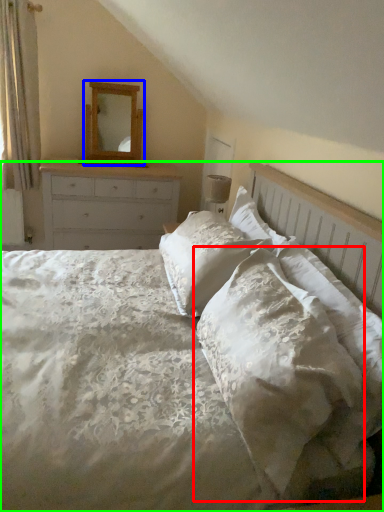
Question: Considering the real-world distances, which object is closest to pillow (highlighted by a red box)? mirror (highlighted by a blue box) or bed (highlighted by a green box).

Choices:
 (A) mirror
 (B) bed

Answer: (B)